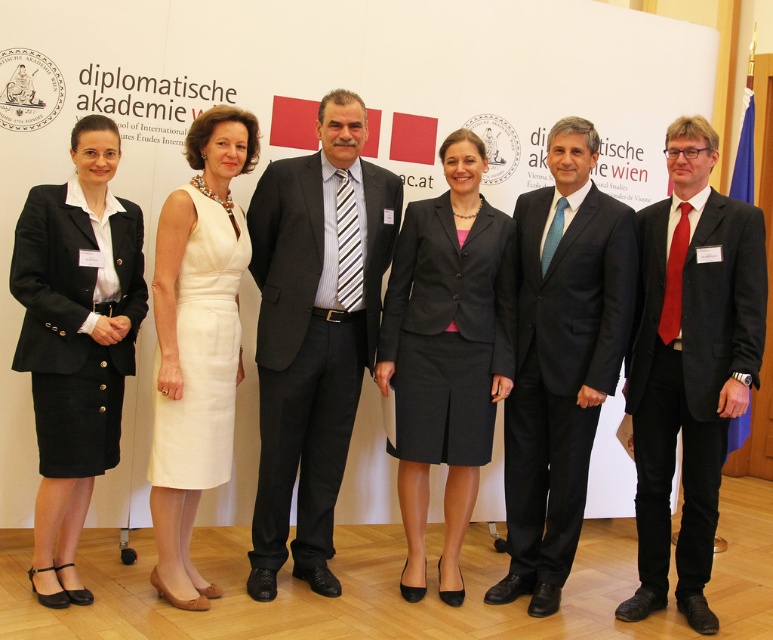
Who is positioned more to the left, matte black suit at right or black wool suit at center?

Positioned to the left is black wool suit at center.

Where is `matte black suit at right`? This screenshot has width=773, height=640. matte black suit at right is located at coordinates (690, 376).

Does matte black suit at right appear under black corduroy business suit at left?

Correct, matte black suit at right is located below black corduroy business suit at left.

The width and height of the screenshot is (773, 640). Describe the element at coordinates (690, 376) in the screenshot. I see `matte black suit at right` at that location.

The width and height of the screenshot is (773, 640). What are the coordinates of `matte black suit at right` in the screenshot? It's located at (690, 376).

Which is more to the left, black wool suit at center or white textured dress at center?

Positioned to the left is white textured dress at center.

Locate an element on the screen. This screenshot has height=640, width=773. black wool suit at center is located at coordinates (562, 371).